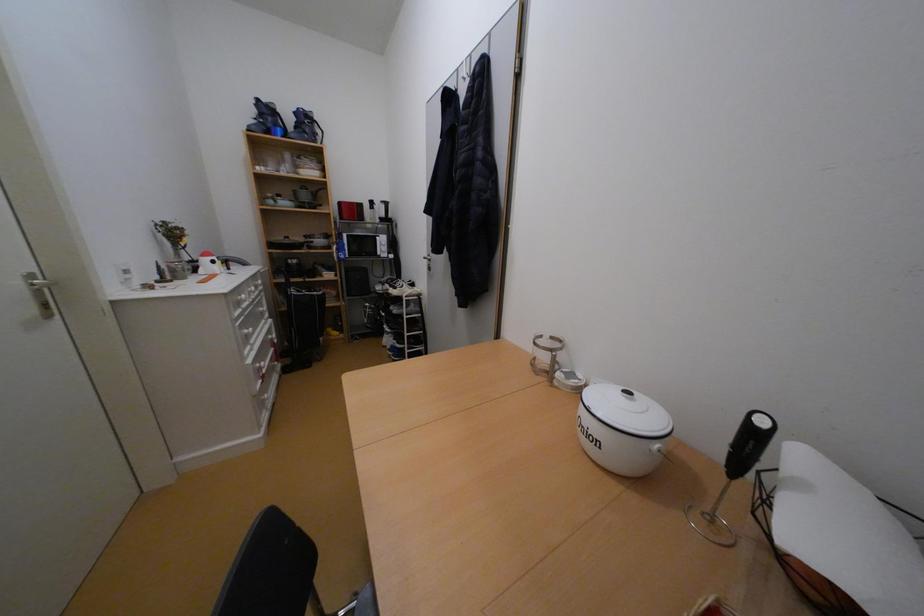
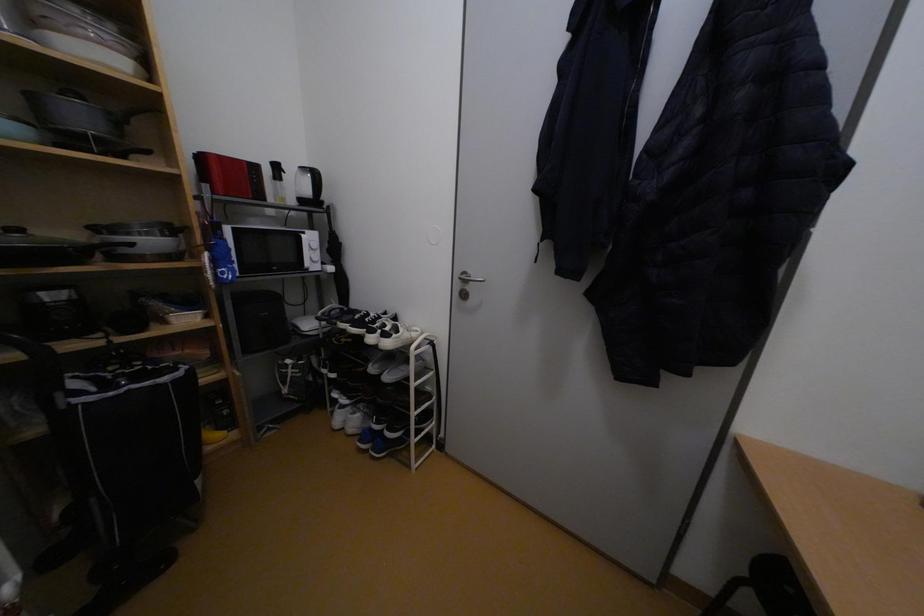
The images are taken continuously from a first-person perspective. In which direction are you moving?

The movement direction of the cameraman is left, forward.